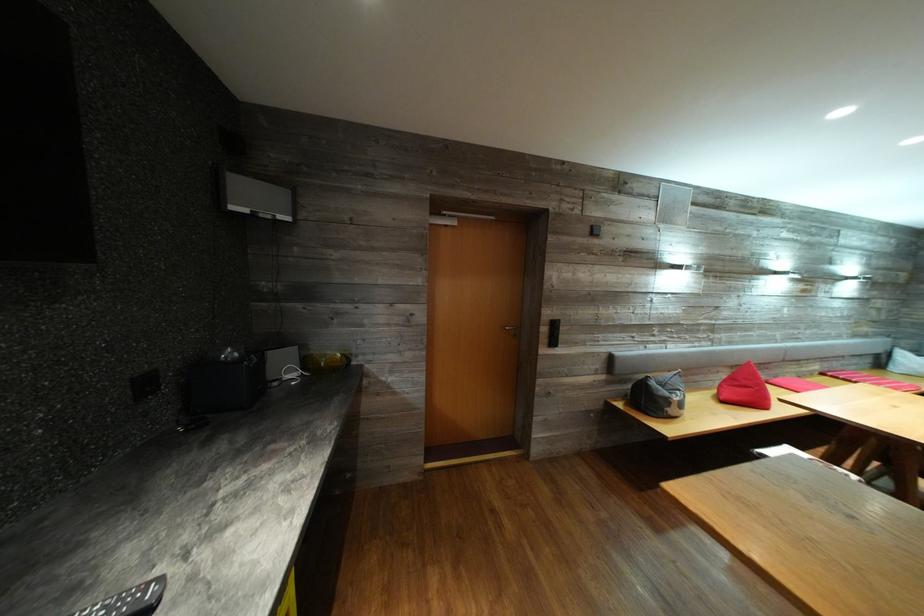
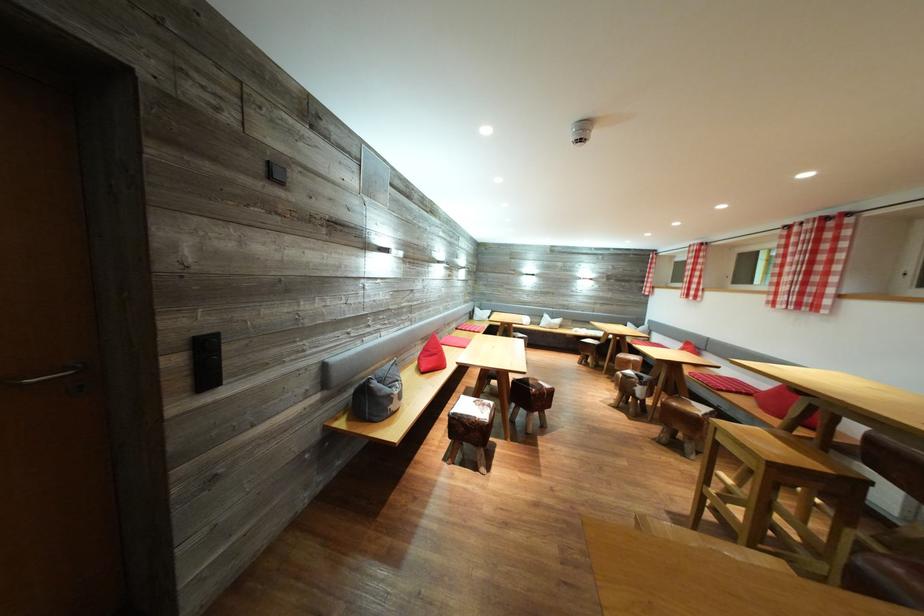
Question: The camera is either moving clockwise (left) or counter-clockwise (right) around the object. The first image is from the beginning of the video and the second image is from the end. Is the camera moving left or right when shooting the video?

Choices:
 (A) Left
 (B) Right

Answer: (A)